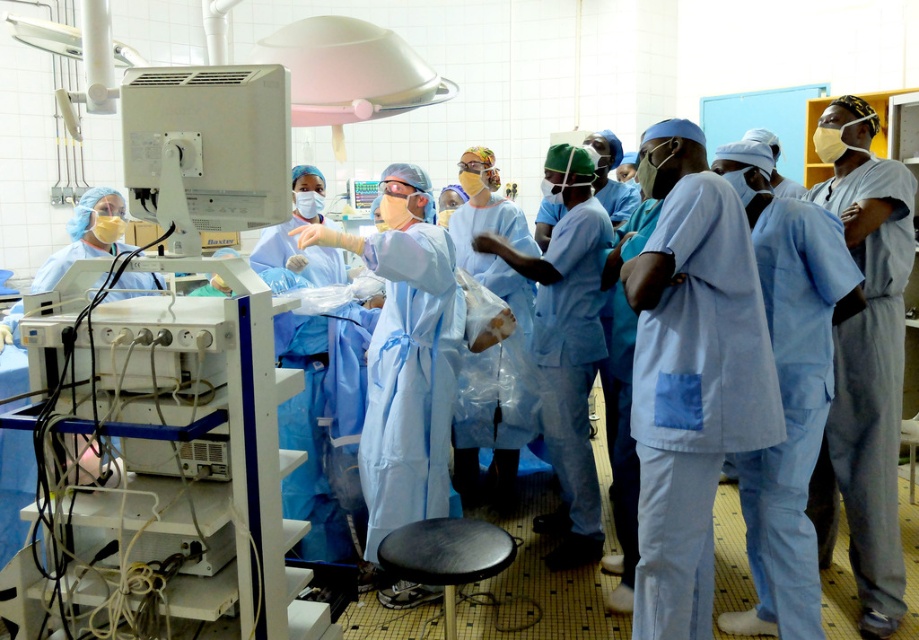
Question: Among these points, which one is farthest from the camera?

Choices:
 (A) (860, 230)
 (B) (642, 598)

Answer: (A)

Question: Is light blue scrubs at center thinner than blue scrubs at center?

Choices:
 (A) yes
 (B) no

Answer: (B)

Question: Does light blue scrubs at center lie in front of blue scrubs at center?

Choices:
 (A) yes
 (B) no

Answer: (A)

Question: Is light blue scrubs at center bigger than blue scrubs at center?

Choices:
 (A) no
 (B) yes

Answer: (A)

Question: Which point is closer to the camera taking this photo?

Choices:
 (A) (654, 540)
 (B) (871, 294)

Answer: (A)